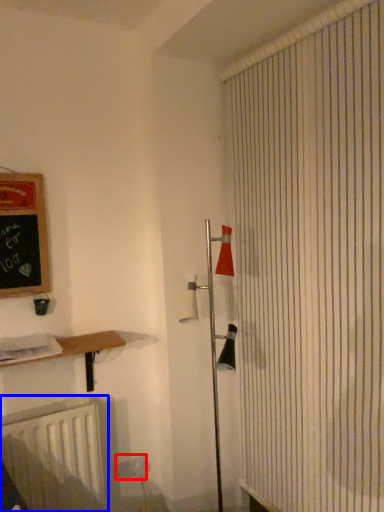
Question: Which object appears closest to the camera in this image, electric outlet (highlighted by a red box) or radiator (highlighted by a blue box)?

Choices:
 (A) electric outlet
 (B) radiator

Answer: (B)